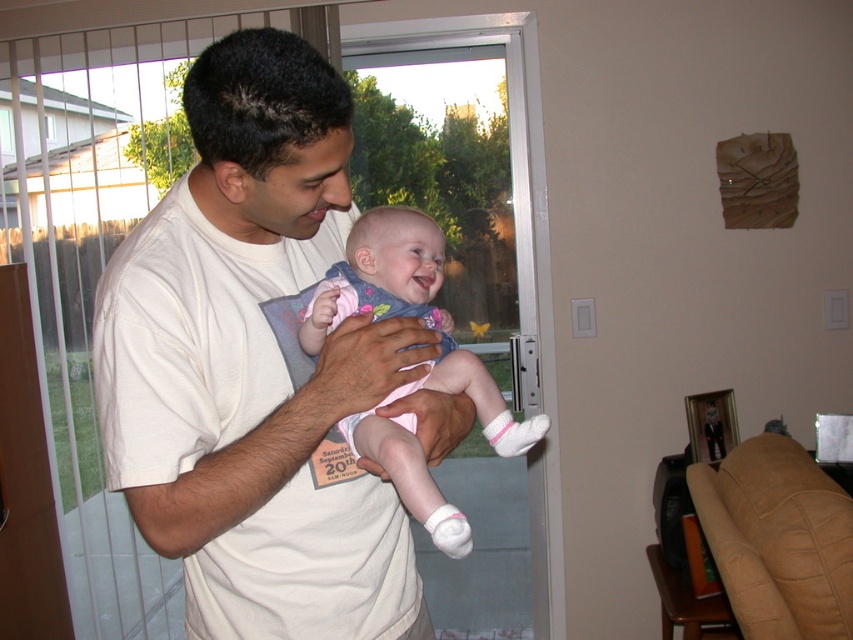
Question: Which point is closer to the camera?

Choices:
 (A) (363, 445)
 (B) (154, 531)

Answer: (B)

Question: Is white cotton shirt at center below pink fabric baby at center?

Choices:
 (A) no
 (B) yes

Answer: (B)

Question: Among these objects, which one is farthest from the camera?

Choices:
 (A) white cotton shirt at center
 (B) pink fabric baby at center

Answer: (B)

Question: Is white cotton shirt at center wider than pink fabric baby at center?

Choices:
 (A) no
 (B) yes

Answer: (B)

Question: Does white cotton shirt at center appear on the right side of pink fabric baby at center?

Choices:
 (A) yes
 (B) no

Answer: (B)